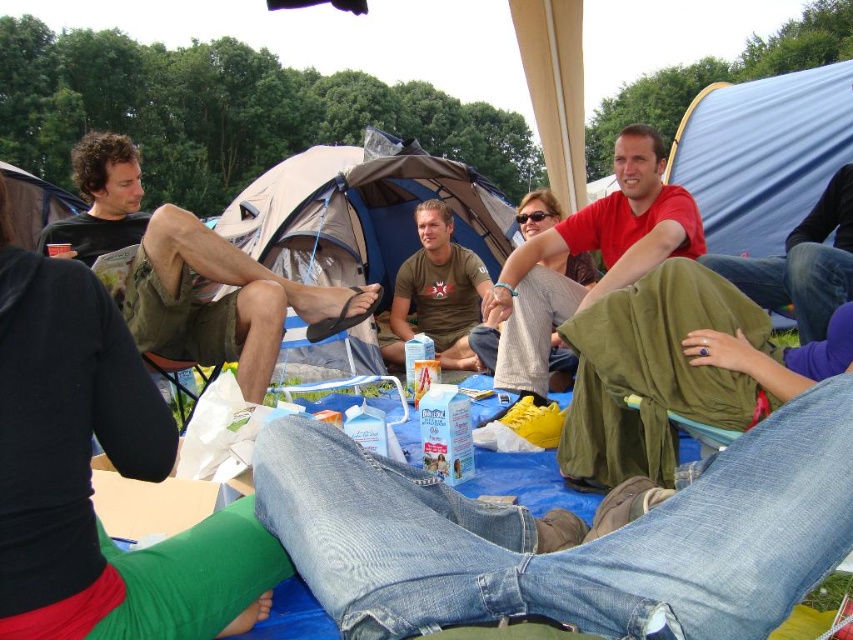
Question: Can you confirm if matte brown t-shirt at center is positioned above matte black tent at left?

Choices:
 (A) yes
 (B) no

Answer: (B)

Question: Can you confirm if matte brown t-shirt at center is smaller than matte black tent at left?

Choices:
 (A) no
 (B) yes

Answer: (A)

Question: Based on their relative distances, which object is nearer to the green fabric blanket at lower right?

Choices:
 (A) dark green shorts at left
 (B) matte black tent at left
 (C) matte brown t-shirt at center
 (D) blue tarpaulin tent at center

Answer: (A)

Question: Which of the following is the closest to the observer?

Choices:
 (A) matte black tent at left
 (B) green fabric blanket at lower right
 (C) matte brown t-shirt at center
 (D) blue tarpaulin tent at center

Answer: (B)

Question: Which object appears closest to the camera in this image?

Choices:
 (A) green fabric blanket at lower right
 (B) matte black tent at left
 (C) matte brown t-shirt at center

Answer: (A)

Question: Is dark green shorts at left further to camera compared to matte black tent at left?

Choices:
 (A) yes
 (B) no

Answer: (B)